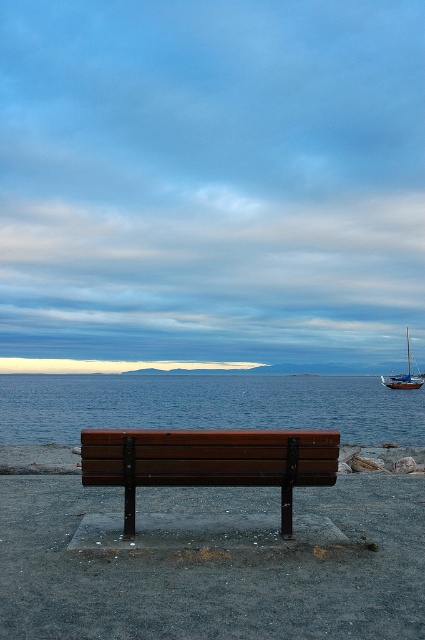
Question: Which object is the closest to the wooden sailboat at right?

Choices:
 (A) blue water at center
 (B) brown wooden bench at center

Answer: (A)

Question: Which of the following is the closest to the observer?

Choices:
 (A) brown wood bench at lower center
 (B) wooden sailboat at right
 (C) brown wooden bench at center

Answer: (C)

Question: Does brown wooden bench at center have a lesser width compared to brown wood bench at lower center?

Choices:
 (A) no
 (B) yes

Answer: (B)

Question: Considering the relative positions of brown wooden bench at center and brown wood bench at lower center in the image provided, where is brown wooden bench at center located with respect to brown wood bench at lower center?

Choices:
 (A) below
 (B) above

Answer: (B)

Question: Which of the following is the closest to the observer?

Choices:
 (A) (343, 470)
 (B) (146, 420)

Answer: (A)

Question: Does blue water at center appear on the left side of brown wood bench at lower center?

Choices:
 (A) no
 (B) yes

Answer: (A)